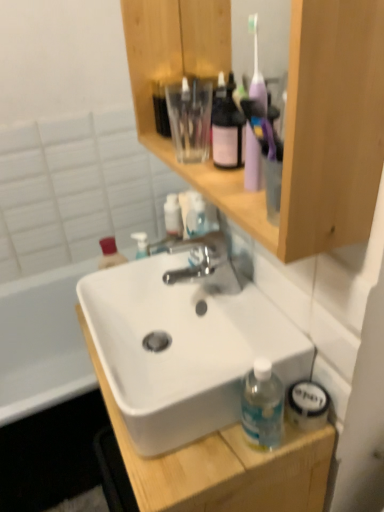
Question: Visually, is polished chrome faucet at center positioned to the left or to the right of white matte sink at center?

Choices:
 (A) left
 (B) right

Answer: (B)

Question: From a real-world perspective, relative to white matte sink at center, is polished chrome faucet at center vertically above or below?

Choices:
 (A) above
 (B) below

Answer: (A)

Question: Considering the real-world distances, which object is farthest from the wooden cabinet at upper center?

Choices:
 (A) white matte sink at center
 (B) polished chrome faucet at center

Answer: (A)

Question: Considering the real-world distances, which object is closest to the wooden cabinet at upper center?

Choices:
 (A) polished chrome faucet at center
 (B) white matte sink at center

Answer: (A)